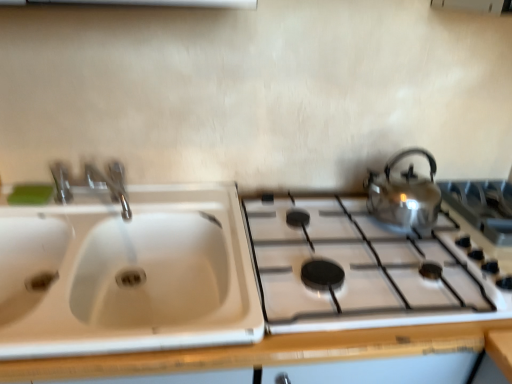
The image size is (512, 384). In order to click on vacant space underneath shiny metallic kettle at right (from a real-world perspective) in this screenshot , I will do `click(394, 226)`.